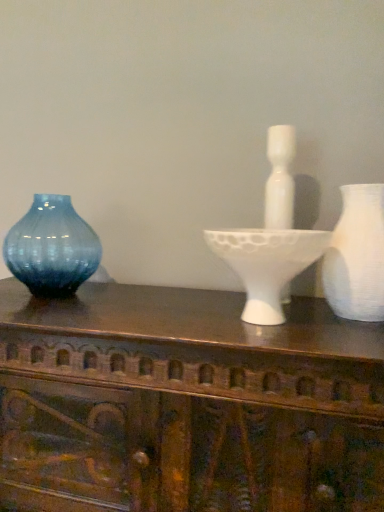
Question: From the image's perspective, is wooden carved table at center under white matte candle holder at center?

Choices:
 (A) yes
 (B) no

Answer: (A)

Question: Does wooden carved table at center have a lesser height compared to white matte candle holder at center?

Choices:
 (A) yes
 (B) no

Answer: (B)

Question: Is wooden carved table at center looking in the opposite direction of white matte candle holder at center?

Choices:
 (A) yes
 (B) no

Answer: (B)

Question: Are wooden carved table at center and white matte candle holder at center far apart?

Choices:
 (A) no
 (B) yes

Answer: (A)

Question: From a real-world perspective, is wooden carved table at center over white matte candle holder at center?

Choices:
 (A) yes
 (B) no

Answer: (B)

Question: Considering the relative sizes of wooden carved table at center and white matte candle holder at center in the image provided, is wooden carved table at center wider than white matte candle holder at center?

Choices:
 (A) yes
 (B) no

Answer: (A)

Question: Is white matte candle holder at center smaller than white matte vase at right, which is counted as the 2th vase, starting from the left?

Choices:
 (A) no
 (B) yes

Answer: (A)

Question: Is white matte candle holder at center shorter than white matte vase at right, which ranks as the first vase in front-to-back order?

Choices:
 (A) yes
 (B) no

Answer: (A)

Question: Is white matte candle holder at center wider than white matte vase at right, the first vase when ordered from right to left?

Choices:
 (A) yes
 (B) no

Answer: (A)

Question: Can you confirm if white matte candle holder at center is positioned to the left of white matte vase at right, which ranks as the first vase in front-to-back order?

Choices:
 (A) yes
 (B) no

Answer: (A)

Question: Does white matte candle holder at center come in front of white matte vase at right, the 2th vase when ordered from back to front?

Choices:
 (A) yes
 (B) no

Answer: (A)

Question: Is white matte candle holder at center taller than white matte vase at right, the 2th vase when ordered from back to front?

Choices:
 (A) no
 (B) yes

Answer: (A)

Question: Considering the relative sizes of white matte vase at right, the 2th vase when ordered from back to front, and white matte candle holder at center in the image provided, is white matte vase at right, the 2th vase when ordered from back to front, smaller than white matte candle holder at center?

Choices:
 (A) yes
 (B) no

Answer: (A)